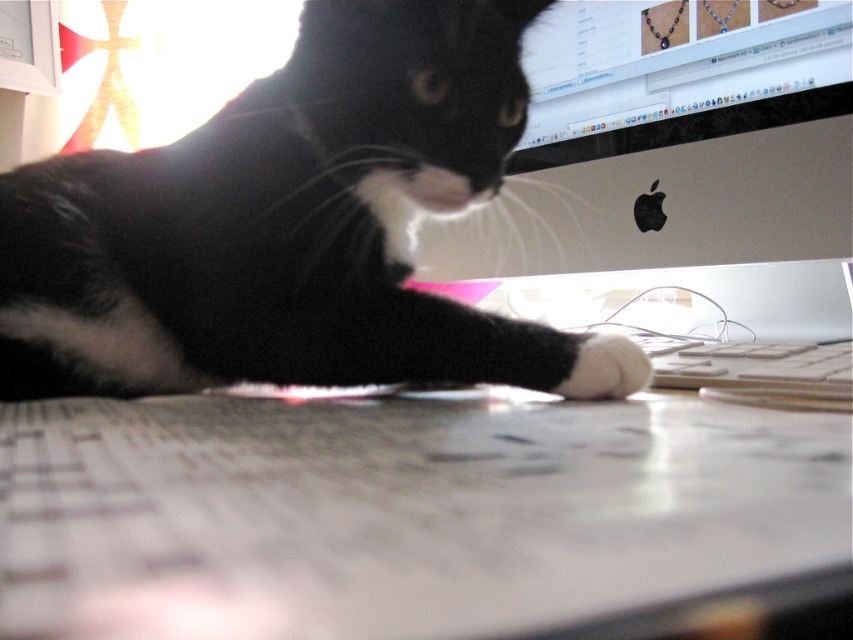
In the scene shown: You are organizing a photo shoot and need to position a white glossy desk at center and a black fur cat at center in a way that the cat is visible above the desk. Based on the scene description, is the current arrangement suitable for the shoot?

The white glossy desk at center is located below the black fur cat at center, so the current arrangement is suitable because the cat is visible above the desk as required.

Consider the image. You are trying to take a screenshot of the webpage displayed on the computer monitor. However, the black fur cat at center is blocking part of the monitor. Based on its position coordinates, can you determine if the cat is covering the main content area of the webpage?

The black fur cat at center is positioned at coordinates (281, 224). Since the cat is at the center of the desk and partially obscuring the monitor, it is likely covering the main content area of the webpage displayed on the computer monitor.